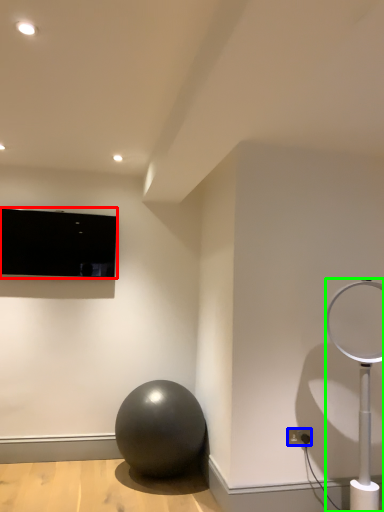
Question: Which is nearer to the television (highlighted by a red box)? electric outlet (highlighted by a blue box) or lamp (highlighted by a green box).

Choices:
 (A) electric outlet
 (B) lamp

Answer: (B)